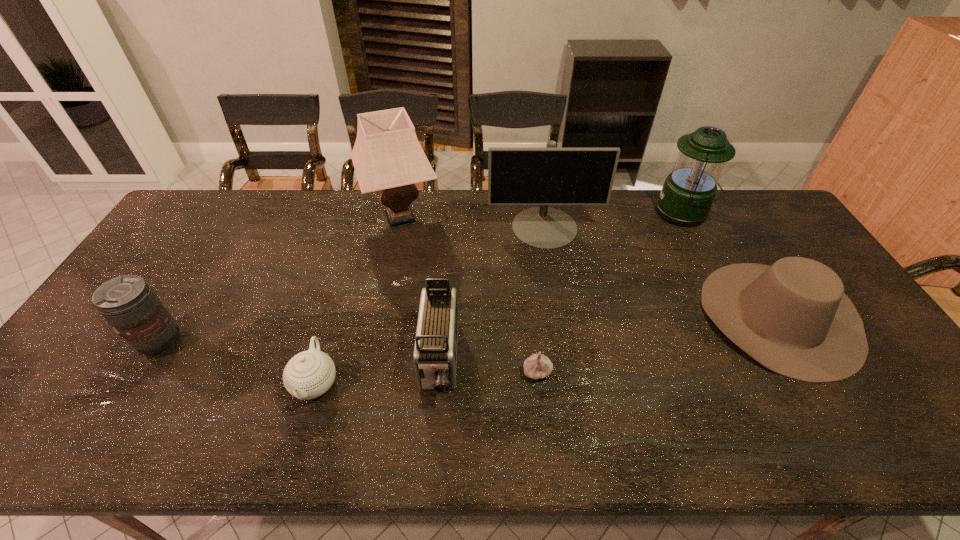
Locate an element on the screen. The height and width of the screenshot is (540, 960). lampshade is located at coordinates (387, 157).

Find the location of a particular element. The width and height of the screenshot is (960, 540). lantern is located at coordinates (687, 195).

This screenshot has width=960, height=540. I want to click on computer monitor, so click(546, 176).

This screenshot has width=960, height=540. Find the location of `the leftmost object`. the leftmost object is located at coordinates (128, 303).

The height and width of the screenshot is (540, 960). Find the location of `camcorder`. camcorder is located at coordinates (435, 351).

Identify the location of the third shortest object. The width and height of the screenshot is (960, 540). (793, 317).

Identify the location of chinaware. The height and width of the screenshot is (540, 960). (309, 374).

You are a GUI agent. You are given a task and a screenshot of the screen. Output one action in this format:
    pyautogui.click(x=<x>, y=<y>)
    Task: Click on the garlic
    This screenshot has height=540, width=960.
    Given the screenshot: What is the action you would take?
    pyautogui.click(x=537, y=366)

What are the coordinates of `vacant space located 0.180m on the left of the lampshade` in the screenshot? It's located at (306, 218).

Find the location of a particular element. This screenshot has width=960, height=540. vacant space located on the left of the lantern is located at coordinates (636, 213).